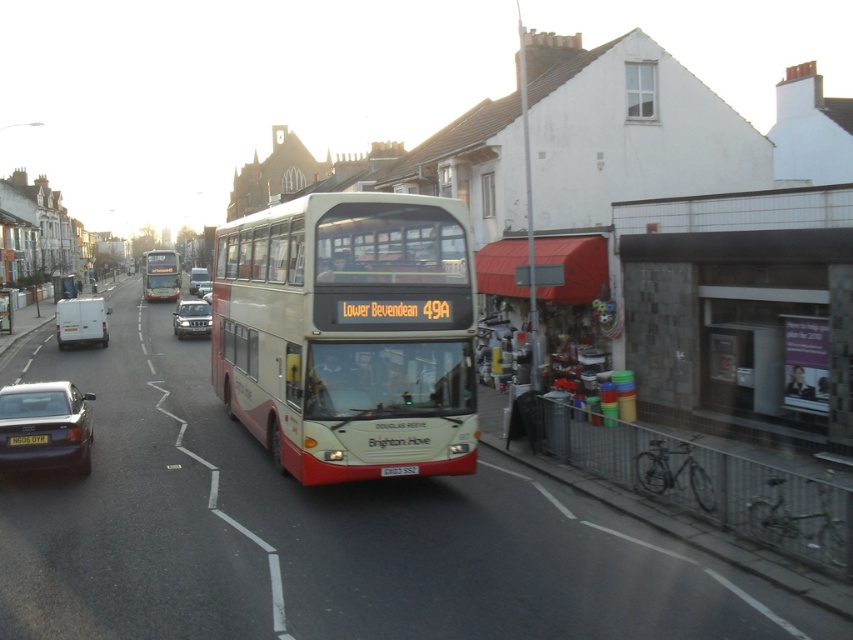
Does matte black car at lower left appear over yellow matte license plate at lower center?

No, matte black car at lower left is not above yellow matte license plate at lower center.

Is matte black car at lower left to the left of yellow matte license plate at lower center from the viewer's perspective?

Correct, you'll find matte black car at lower left to the left of yellow matte license plate at lower center.

Identify the location of matte black car at lower left. Image resolution: width=853 pixels, height=640 pixels. (44, 426).

You are a GUI agent. You are given a task and a screenshot of the screen. Output one action in this format:
    pyautogui.click(x=<x>, y=<y>)
    Task: Click on the matte red bus at center
    The height and width of the screenshot is (640, 853).
    Given the screenshot: What is the action you would take?
    pyautogui.click(x=349, y=333)

Is point (430, 332) in front of point (102, 308)?

Yes, it is.

Is point (467, 244) positioned before point (59, 340)?

Yes, it is in front of point (59, 340).

Where is `matte red bus at center`? matte red bus at center is located at coordinates (349, 333).

Between point (177, 294) and point (18, 442), which one is positioned in front?

Positioned in front is point (18, 442).

Can you confirm if matte white bus at center is positioned to the right of yellow matte license plate at lower center?

Incorrect, matte white bus at center is not on the right side of yellow matte license plate at lower center.

Find the location of `matte white bus at center`. matte white bus at center is located at coordinates (161, 275).